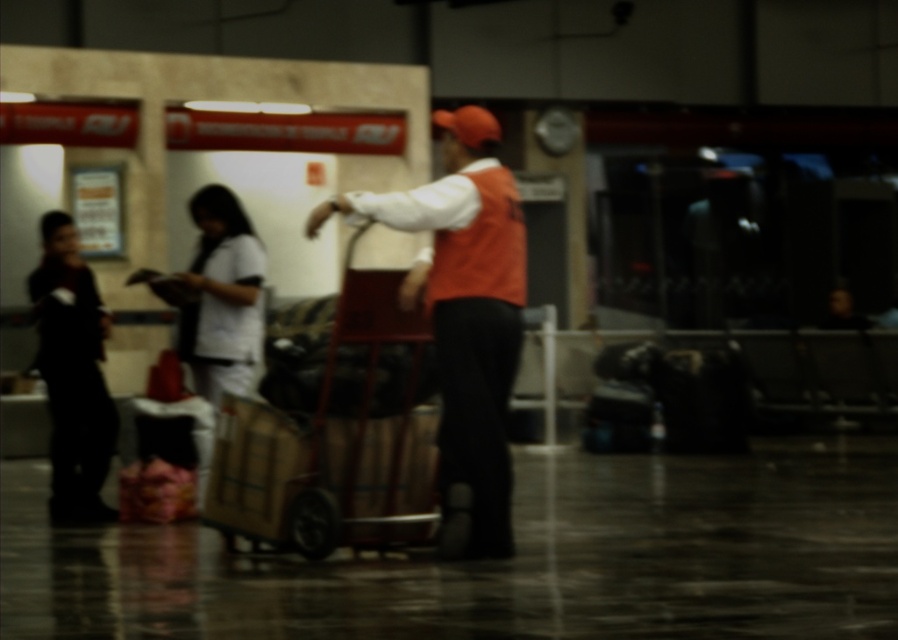
Question: Can you confirm if orange fabric vest at center is positioned above white cotton shirt at center?

Choices:
 (A) no
 (B) yes

Answer: (A)

Question: Is wooden trolley at center positioned at the back of black matte jacket at left?

Choices:
 (A) no
 (B) yes

Answer: (A)

Question: In this image, where is wooden trolley at center located relative to white cotton shirt at center?

Choices:
 (A) right
 (B) left

Answer: (A)

Question: Among these points, which one is farthest from the camera?

Choices:
 (A) (380, 307)
 (B) (222, 260)
 (C) (102, 483)
 (D) (454, 433)

Answer: (C)

Question: Which point is closer to the camera taking this photo?

Choices:
 (A) (509, 212)
 (B) (322, 492)
 (C) (192, 316)

Answer: (B)

Question: Which object appears farthest from the camera in this image?

Choices:
 (A) orange fabric vest at center
 (B) black matte jacket at left
 (C) white cotton shirt at center

Answer: (B)